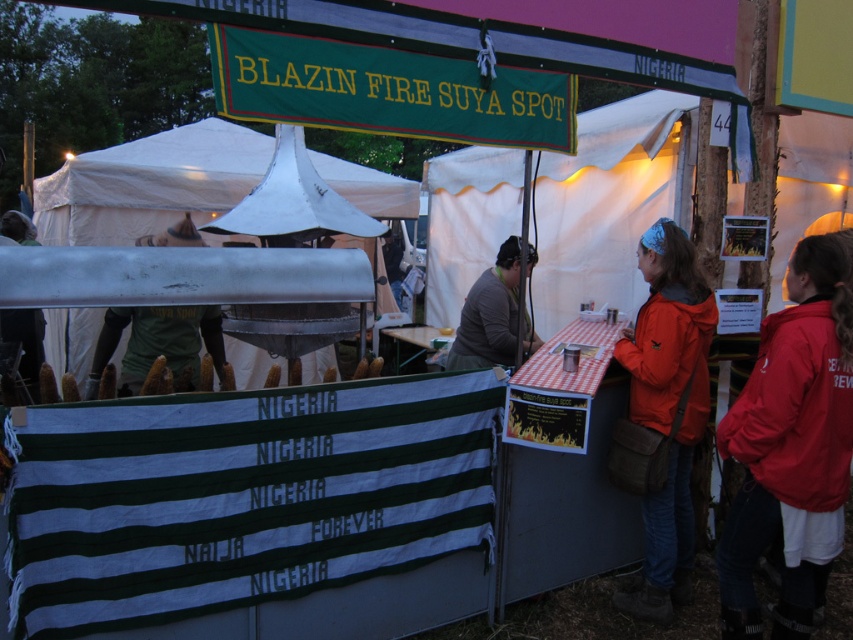
Who is positioned more to the left, white canvas tent at center or matte green corn at center?

Positioned to the left is matte green corn at center.

Which is in front, point (646, 198) or point (190, 369)?

Point (190, 369) is more forward.

Image resolution: width=853 pixels, height=640 pixels. In order to click on white canvas tent at center in this screenshot , I will do `click(607, 204)`.

Is red nylon jacket at right above metallic tent at center?

Actually, red nylon jacket at right is below metallic tent at center.

You are a GUI agent. You are given a task and a screenshot of the screen. Output one action in this format:
    pyautogui.click(x=<x>, y=<y>)
    Task: Click on the red nylon jacket at right
    This screenshot has height=640, width=853.
    Given the screenshot: What is the action you would take?
    pyautogui.click(x=791, y=445)

Identify the location of red nylon jacket at right. (791, 445).

Does metallic tent at center have a lesser height compared to matte green corn at center?

Incorrect, metallic tent at center's height does not fall short of matte green corn at center's.

Based on the photo, can you confirm if metallic tent at center is taller than matte green corn at center?

Yes.

Does point (74, 196) come farther from viewer compared to point (135, 316)?

Yes, point (74, 196) is behind point (135, 316).

Find the location of a particular element. metallic tent at center is located at coordinates (149, 182).